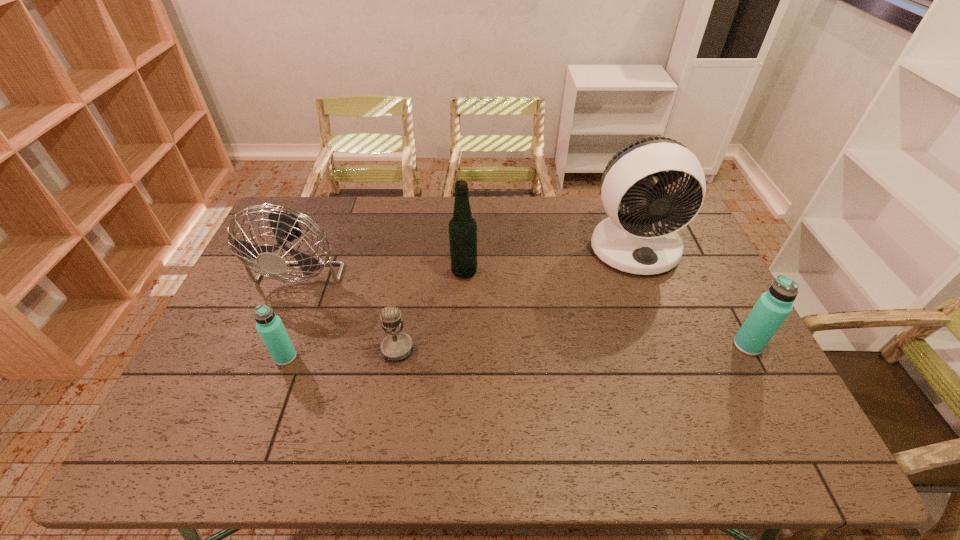
Please point a space for a new thermos_bottle to maintain equal intervals. Please provide its 2D coordinates. Your answer should be formatted as a tuple, i.e. [(x, y)], where the tuple contains the x and y coordinates of a point satisfying the conditions above.

[(519, 351)]